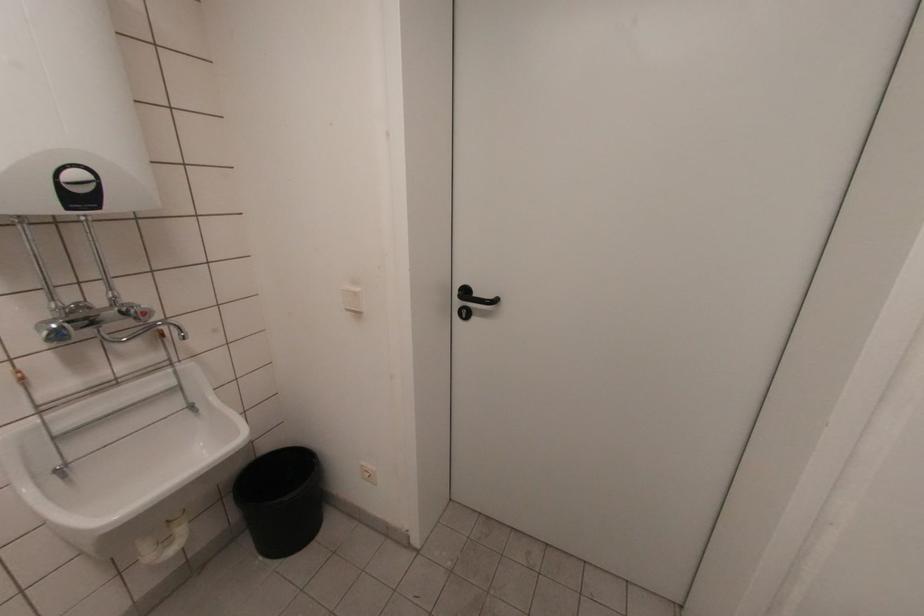
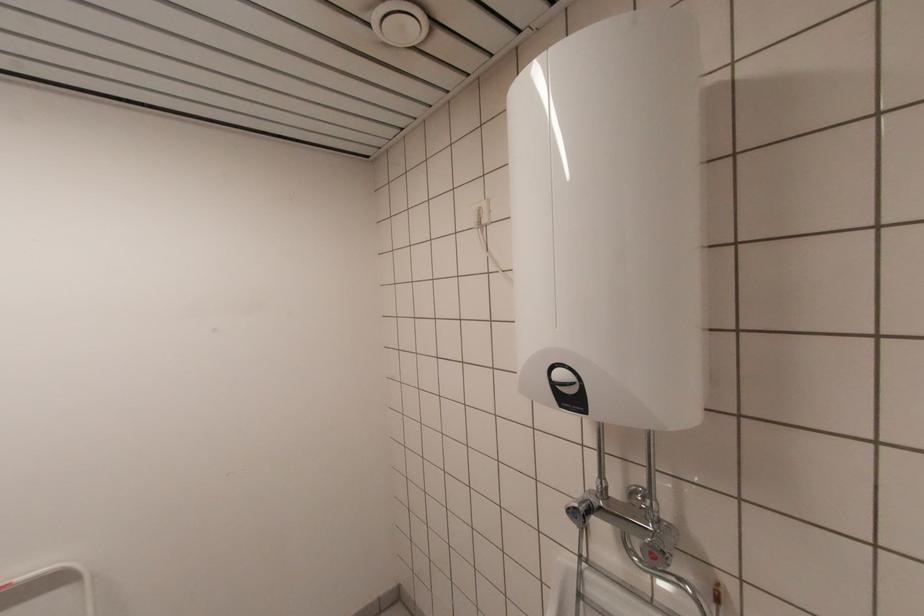
Question: The images are taken continuously from a first-person perspective. In which direction is your viewpoint rotating?

Choices:
 (A) Left
 (B) Right
 (C) Up
 (D) Down

Answer: (A)